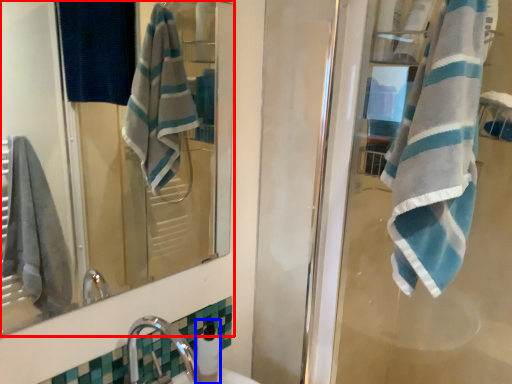
Question: Which object appears farthest to the camera in this image, mirror (highlighted by a red box) or soap dispenser (highlighted by a blue box)?

Choices:
 (A) mirror
 (B) soap dispenser

Answer: (B)